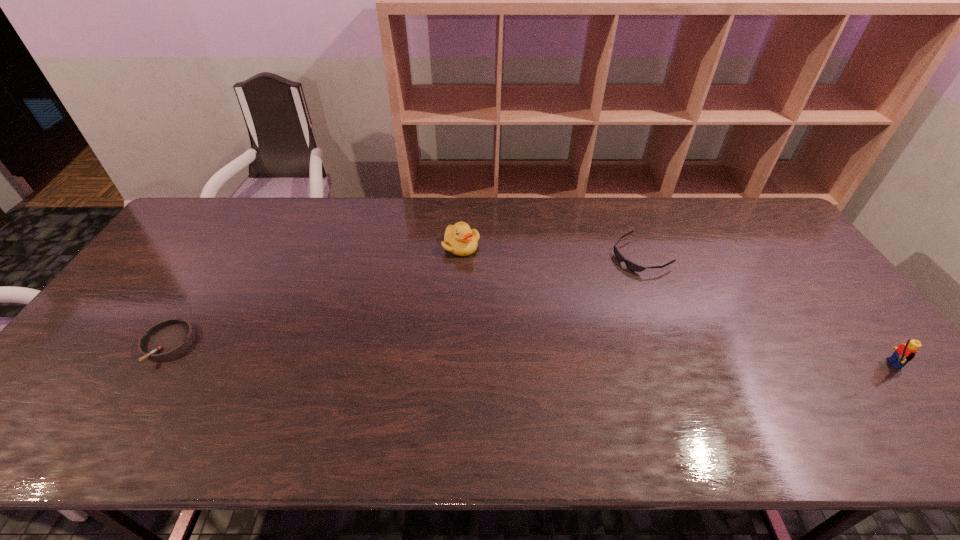
I want to click on the third closest object to the tallest object, so (166, 339).

Locate an element on the screen. free point that satisfies the following two spatial constraints: 1. on the front side of the second shortest object; 2. on the front-facing side of the Lego is located at coordinates (155, 364).

Locate an element on the screen. This screenshot has height=540, width=960. vacant region that satisfies the following two spatial constraints: 1. on the back side of the shortest object; 2. on the right side of the leftmost object is located at coordinates (224, 255).